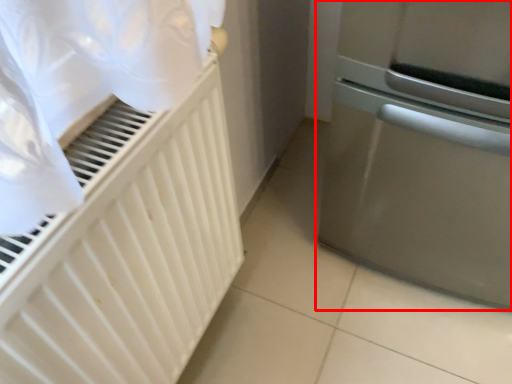
Question: Considering the relative positions of home appliance (annotated by the red box) and radiator in the image provided, where is home appliance (annotated by the red box) located with respect to the staircase?

Choices:
 (A) left
 (B) right

Answer: (B)